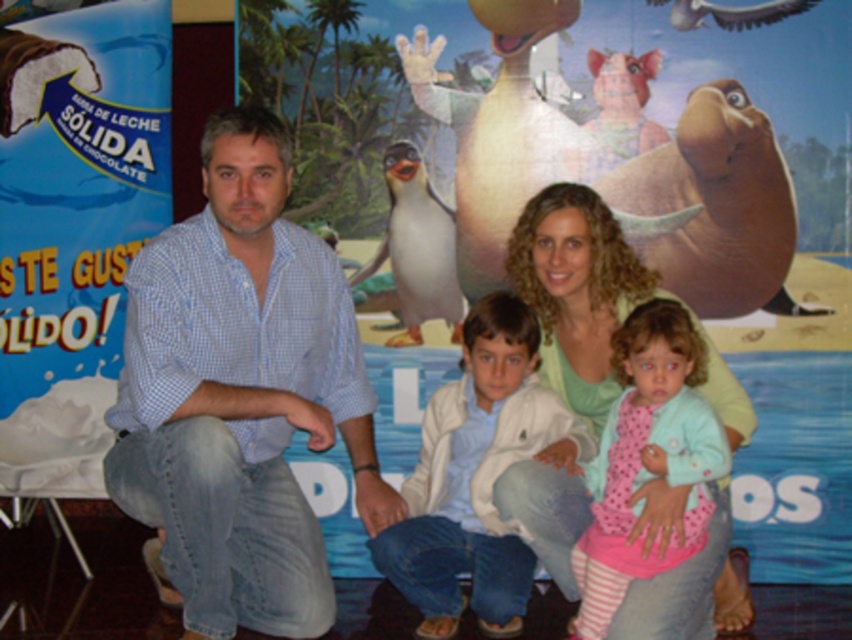
You are a photographer setting up a camera at eye level with the blue checkered shirt at left and the pink striped fabric at center. Which object is taller when viewed from your position?

The blue checkered shirt at left is taller than the pink striped fabric at center.